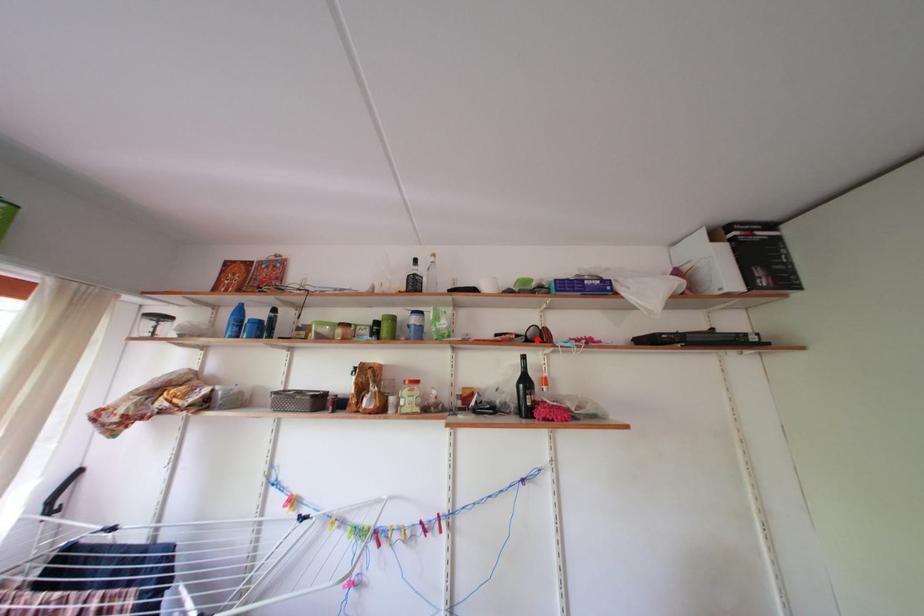
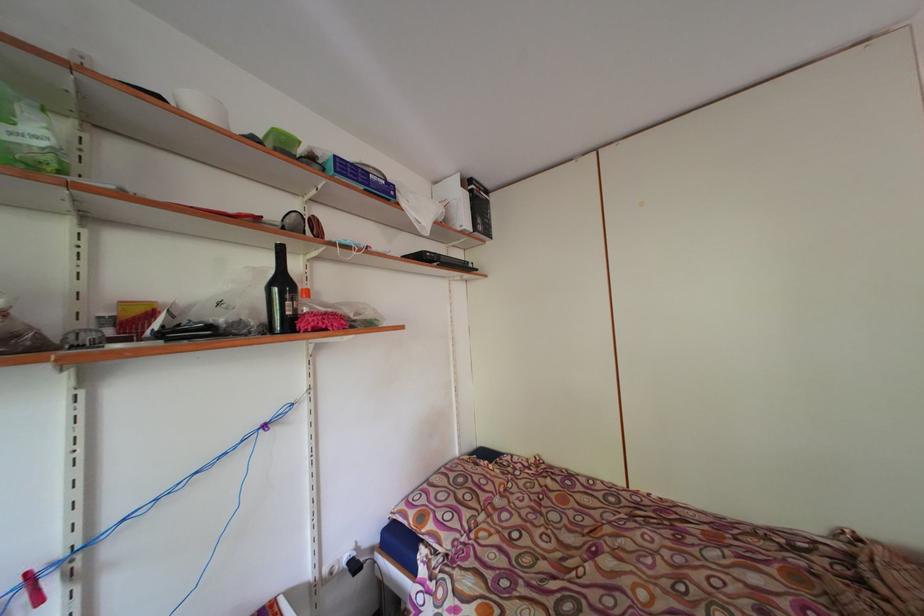
Locate, in the second image, the point that corresponds to the highlighted location in the first image.

(296, 227)